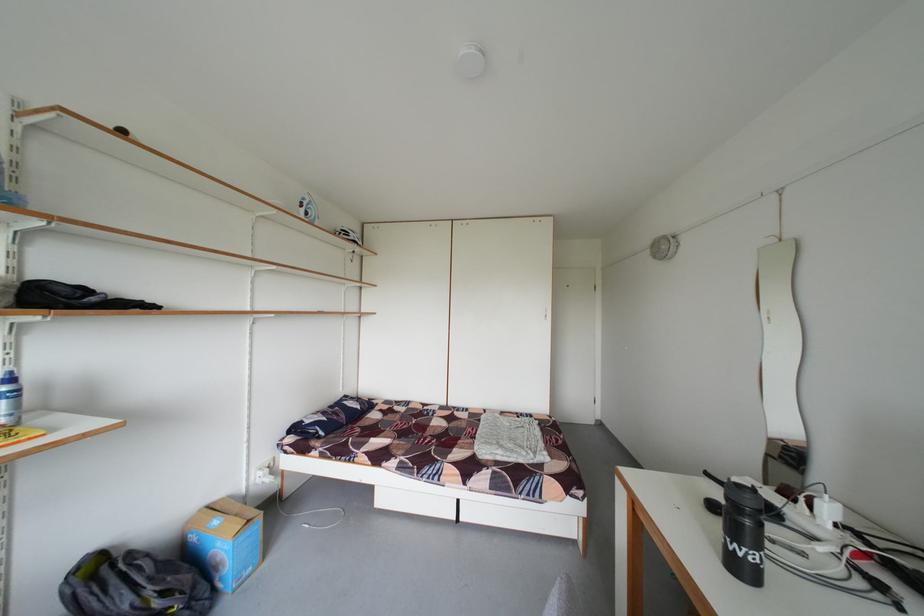
The image size is (924, 616). What do you see at coordinates (744, 496) in the screenshot?
I see `the black bottle lid` at bounding box center [744, 496].